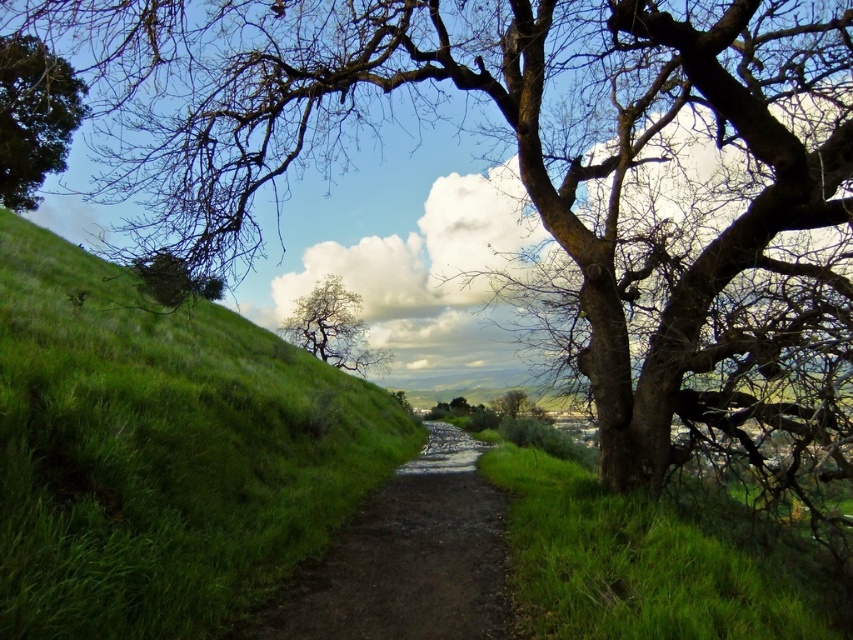
Question: Does bare branches tree at center come behind bare wood tree at center?

Choices:
 (A) no
 (B) yes

Answer: (B)

Question: Which of the following is the closest to the observer?

Choices:
 (A) (519, 400)
 (B) (662, 616)
 (C) (109, 326)

Answer: (B)

Question: Is green grassy at right smaller than bare branches tree at center?

Choices:
 (A) no
 (B) yes

Answer: (B)

Question: Which of the following is the farthest from the observer?

Choices:
 (A) dirt path at center
 (B) green grassy hillside at left
 (C) green grassy at right

Answer: (A)

Question: Which point is farther to the camera?

Choices:
 (A) coord(146,392)
 (B) coord(683,612)

Answer: (A)

Question: Does green grassy hillside at left appear on the right side of green leafy tree at upper left?

Choices:
 (A) yes
 (B) no

Answer: (A)